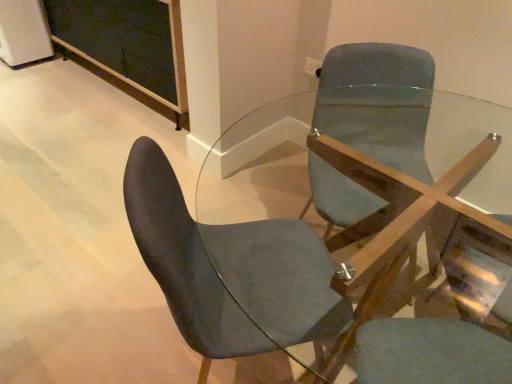
Question: From a real-world perspective, is matte blue swivel chair at center positioned under clear glass table at center based on gravity?

Choices:
 (A) yes
 (B) no

Answer: (B)

Question: Is there a large distance between matte blue swivel chair at center and clear glass table at center?

Choices:
 (A) yes
 (B) no

Answer: (B)

Question: Is matte blue swivel chair at center wider than clear glass table at center?

Choices:
 (A) yes
 (B) no

Answer: (B)

Question: Does matte blue swivel chair at center lie behind clear glass table at center?

Choices:
 (A) yes
 (B) no

Answer: (B)

Question: Is clear glass table at center located within matte blue swivel chair at center?

Choices:
 (A) no
 (B) yes

Answer: (A)

Question: In terms of height, does clear glass table at center look taller or shorter compared to velvet dark blue chair at center?

Choices:
 (A) tall
 (B) short

Answer: (B)

Question: Considering the positions of clear glass table at center and velvet dark blue chair at center in the image, is clear glass table at center wider or thinner than velvet dark blue chair at center?

Choices:
 (A) wide
 (B) thin

Answer: (A)

Question: Does point (330, 294) appear closer or farther from the camera than point (251, 238)?

Choices:
 (A) farther
 (B) closer

Answer: (B)

Question: In the image, is clear glass table at center on the left side or the right side of velvet dark blue chair at center?

Choices:
 (A) right
 (B) left

Answer: (A)

Question: From a real-world perspective, is matte blue swivel chair at center above or below clear glass table at center?

Choices:
 (A) above
 (B) below

Answer: (A)

Question: From their relative heights in the image, would you say matte blue swivel chair at center is taller or shorter than clear glass table at center?

Choices:
 (A) tall
 (B) short

Answer: (A)

Question: Which is correct: matte blue swivel chair at center is inside clear glass table at center, or outside of it?

Choices:
 (A) outside
 (B) inside

Answer: (B)

Question: Would you say matte blue swivel chair at center is to the left or to the right of clear glass table at center in the picture?

Choices:
 (A) left
 (B) right

Answer: (B)

Question: From the image's perspective, is velvet dark blue chair at center positioned above or below matte blue swivel chair at center?

Choices:
 (A) below
 (B) above

Answer: (B)

Question: From their relative heights in the image, would you say velvet dark blue chair at center is taller or shorter than matte blue swivel chair at center?

Choices:
 (A) short
 (B) tall

Answer: (B)